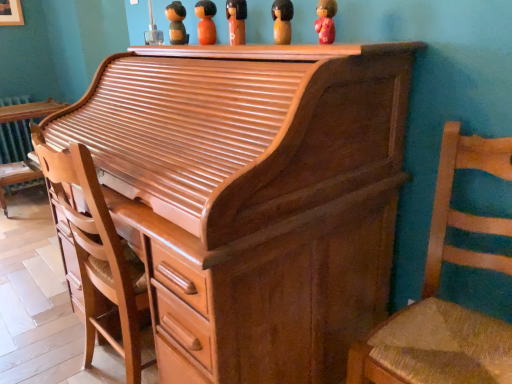
Image resolution: width=512 pixels, height=384 pixels. Identify the location of free location to the left of wooden figurine at upper center, the second toy viewed from the front. (226, 46).